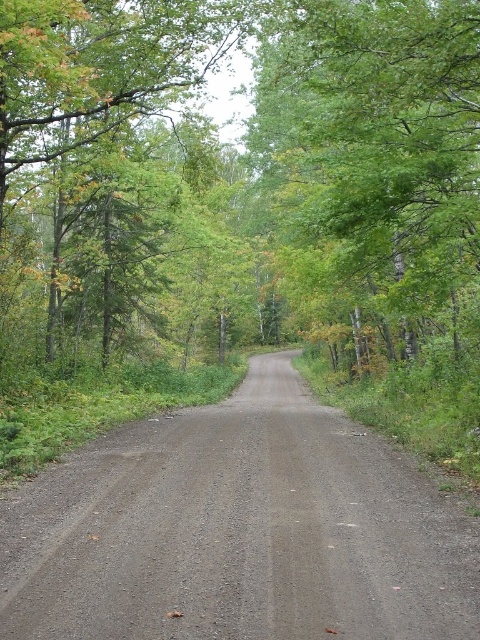
Can you confirm if green leafy tree at center is shorter than gray gravel road at center?

In fact, green leafy tree at center may be taller than gray gravel road at center.

Is green leafy tree at center wider than gray gravel road at center?

Indeed, green leafy tree at center has a greater width compared to gray gravel road at center.

Measure the distance between point [358,29] and camera.

They are 11.05 meters apart.

Image resolution: width=480 pixels, height=640 pixels. What are the coordinates of `green leafy tree at center` in the screenshot? It's located at (240, 163).